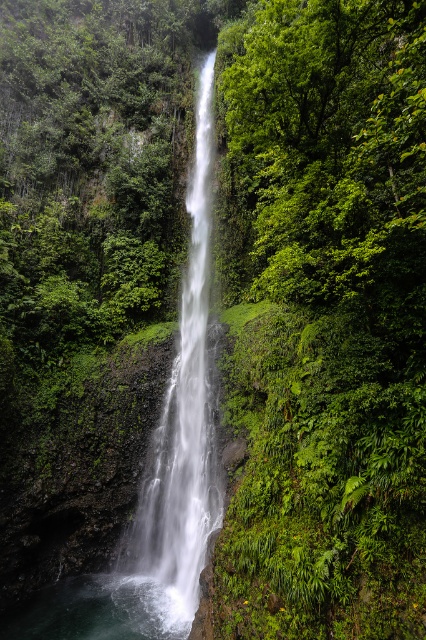
Describe the element at coordinates (178, 440) in the screenshot. I see `white smooth waterfall at center` at that location.

Does white smooth waterfall at center have a lesser height compared to clear water at bottom center?

No.

What are the coordinates of `white smooth waterfall at center` in the screenshot? It's located at (178, 440).